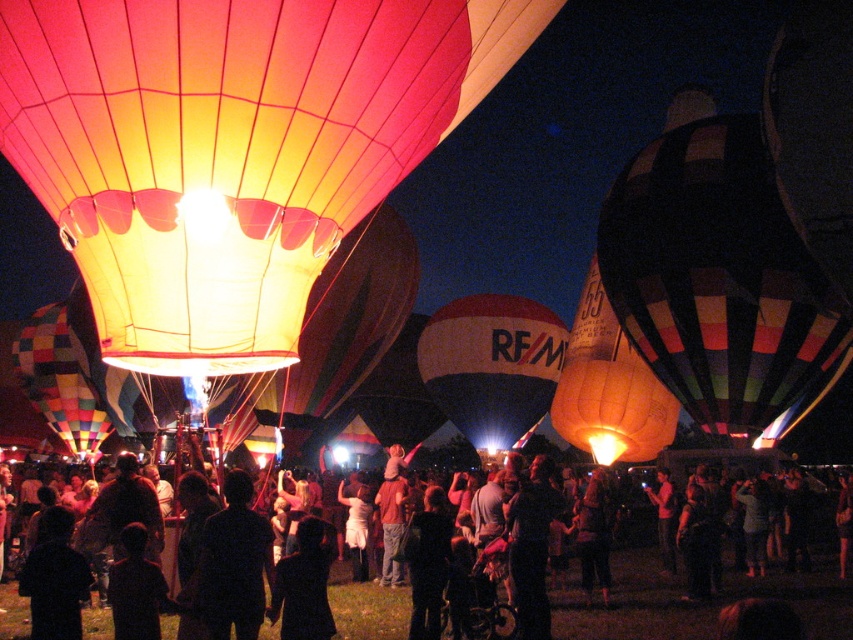
You are a photographer trying to capture the crowd and the coat in the scene. Which object, the matte black crowd at center or the dark fabric coat at center, would appear bigger in your photo?

The matte black crowd at center has a larger size compared to the dark fabric coat at center, so it would appear bigger in the photo.

You are standing at the center of the hot air balloon festival and see the multicolored striped fabric hot air balloon at right and the dark fabric coat at center. Which object is located to the right of the other?

The multicolored striped fabric hot air balloon at right is positioned on the right side of dark fabric coat at center.